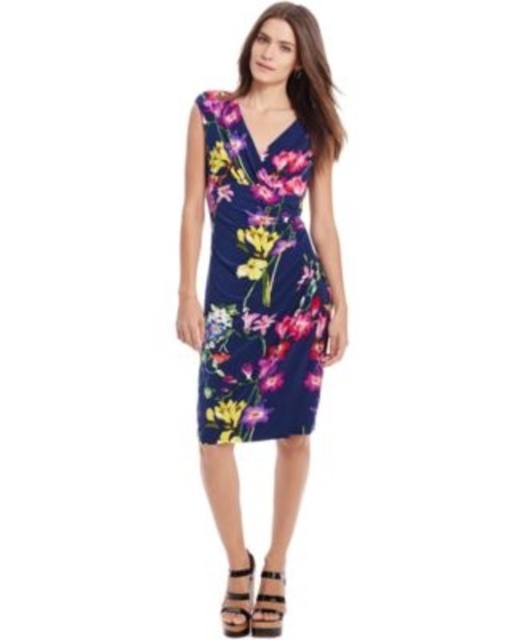
Question: Among these objects, which one is nearest to the camera?

Choices:
 (A) matte black sandal at lower center
 (B) black leather sandal at lower center

Answer: (A)

Question: Observing the image, what is the correct spatial positioning of floral print jersey dress at center in reference to matte black sandal at lower center?

Choices:
 (A) above
 (B) below

Answer: (A)

Question: Which object is the farthest from the floral print jersey dress at center?

Choices:
 (A) black leather sandal at lower center
 (B) matte black sandal at lower center
 (C) floral print dress at center

Answer: (A)

Question: Can you confirm if floral print dress at center is thinner than black leather sandal at lower center?

Choices:
 (A) no
 (B) yes

Answer: (A)

Question: Does floral print dress at center have a lesser width compared to floral print jersey dress at center?

Choices:
 (A) yes
 (B) no

Answer: (B)

Question: Which point appears closest to the camera in this image?

Choices:
 (A) pos(277,268)
 (B) pos(330,307)

Answer: (A)